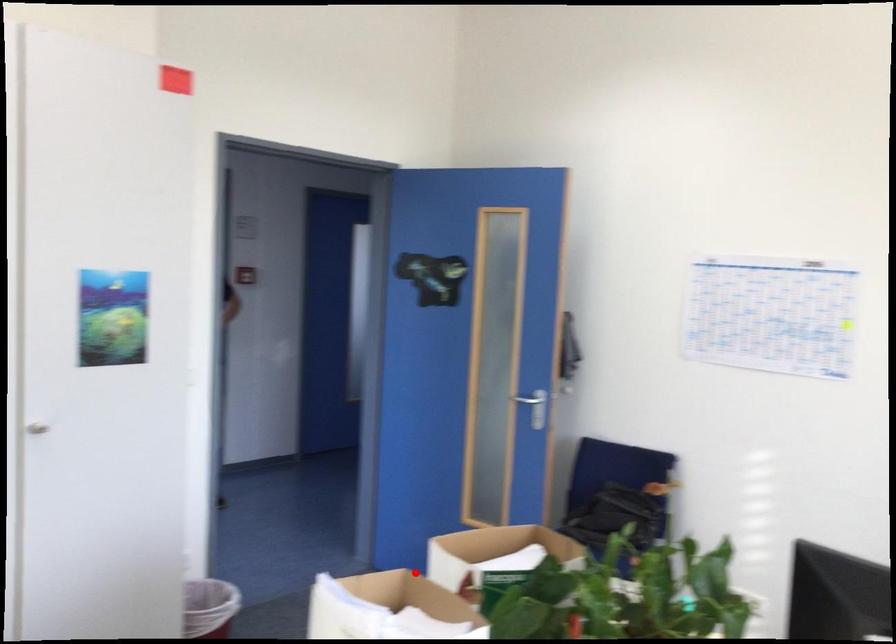
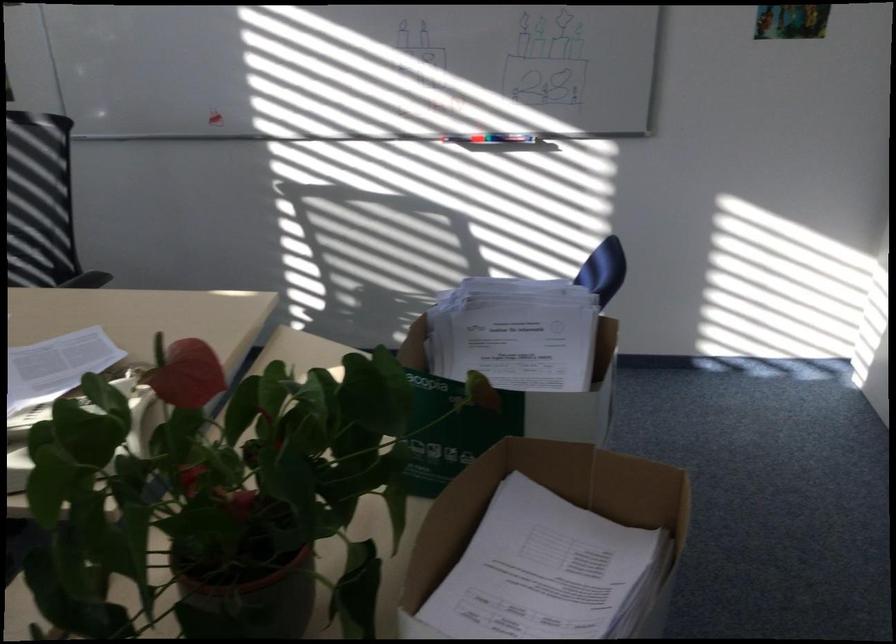
Question: A red point is marked in image1. In image2, is the corresponding 3D point closer to the camera or farther? Reply with the corresponding letter.

Choices:
 (A) The corresponding 3D point is closer.
 (B) The corresponding 3D point is farther.

Answer: (A)